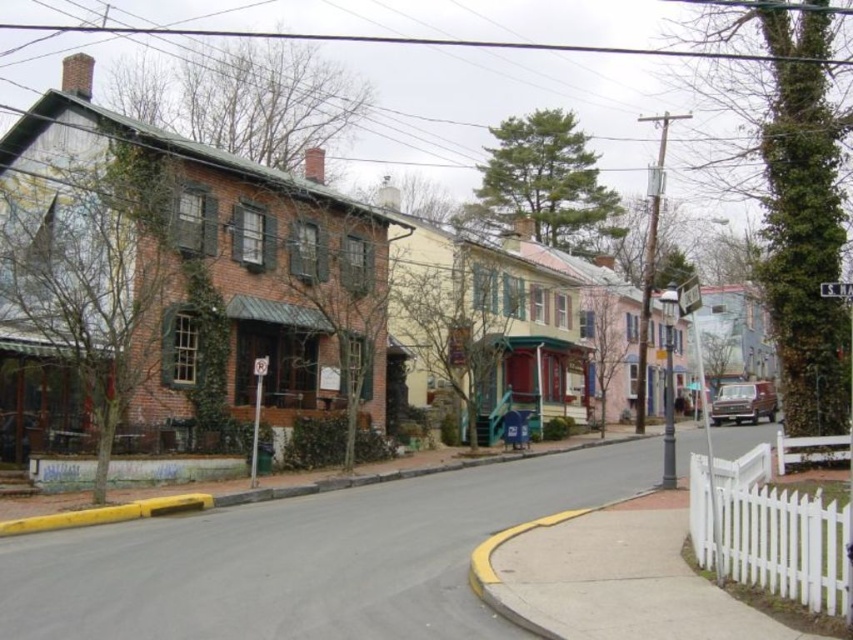
Question: Which object is closer to the camera taking this photo?

Choices:
 (A) yellow painted curb at lower left
 (B) brick building at left

Answer: (A)

Question: In this image, where is brick building at left located relative to yellow painted curb at lower left?

Choices:
 (A) right
 (B) left

Answer: (B)

Question: Which point is farther to the camera?

Choices:
 (A) click(90, 525)
 (B) click(462, 380)

Answer: (B)

Question: Can you confirm if brick building at left is wider than yellow painted curb at lower left?

Choices:
 (A) no
 (B) yes

Answer: (B)

Question: Is brick building at left smaller than yellow painted curb at lower left?

Choices:
 (A) yes
 (B) no

Answer: (B)

Question: Which of the following is the closest to the observer?

Choices:
 (A) (265, 250)
 (B) (215, 500)

Answer: (B)